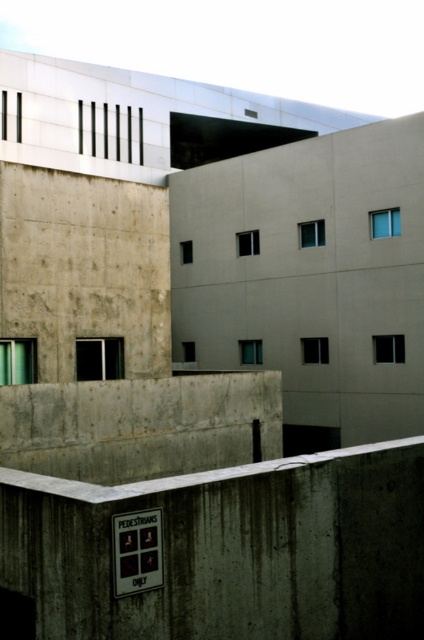
Question: Is gray concrete wall at lower center above concrete ledge at lower center?

Choices:
 (A) no
 (B) yes

Answer: (B)

Question: Which point is farther to the camera?

Choices:
 (A) (13, 468)
 (B) (276, 536)

Answer: (A)

Question: Does gray concrete wall at lower center appear on the right side of concrete ledge at lower center?

Choices:
 (A) yes
 (B) no

Answer: (B)

Question: Does gray concrete wall at lower center appear on the left side of concrete ledge at lower center?

Choices:
 (A) yes
 (B) no

Answer: (A)

Question: Which object appears farthest from the camera in this image?

Choices:
 (A) concrete ledge at lower center
 (B) gray concrete wall at lower center

Answer: (A)

Question: Which point is closer to the camera?

Choices:
 (A) (66, 497)
 (B) (328, 467)

Answer: (A)